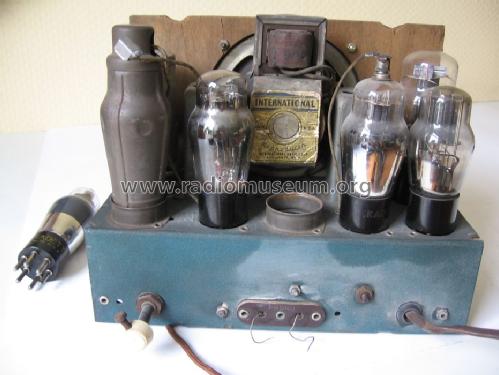
Where is `wooden back piece`? wooden back piece is located at coordinates click(199, 43).